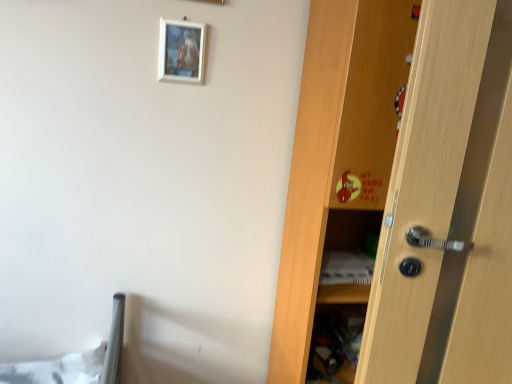
The height and width of the screenshot is (384, 512). Identify the location of white glossy picture frame at upper center. (182, 51).

The width and height of the screenshot is (512, 384). Describe the element at coordinates (182, 51) in the screenshot. I see `white glossy picture frame at upper center` at that location.

What are the coordinates of `white glossy picture frame at upper center` in the screenshot? It's located at (182, 51).